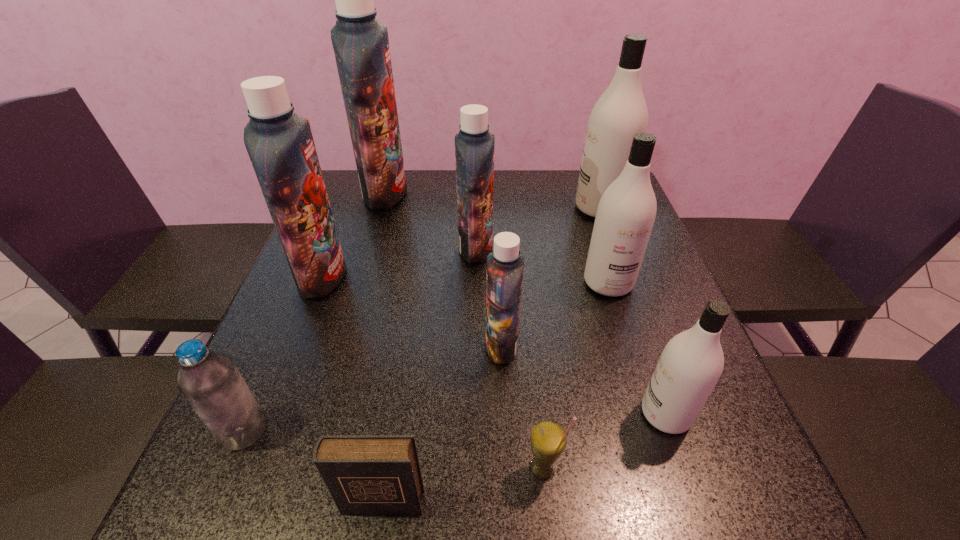
I want to click on the tallest object, so click(361, 45).

The height and width of the screenshot is (540, 960). Find the location of `the biggest blue shampoo`. the biggest blue shampoo is located at coordinates (361, 45).

Identify the location of the biggest white shampoo. The width and height of the screenshot is (960, 540). (621, 111).

I want to click on the second biggest blue shampoo, so click(x=280, y=144).

Where is `the third biggest blue shampoo`? the third biggest blue shampoo is located at coordinates (474, 145).

Where is `the second farthest white shampoo`? the second farthest white shampoo is located at coordinates (626, 212).

The height and width of the screenshot is (540, 960). Find the location of `the sixth farthest object`. the sixth farthest object is located at coordinates (505, 265).

You are a GUI agent. You are given a task and a screenshot of the screen. Output one action in this format:
    pyautogui.click(x=<x>, y=<y>)
    Task: Click on the second nearest shampoo
    This screenshot has width=960, height=540.
    Given the screenshot: What is the action you would take?
    pyautogui.click(x=505, y=265)

The image size is (960, 540). Find the location of `the nearest shampoo`. the nearest shampoo is located at coordinates (691, 363).

Find the location of a particular element. The image size is (960, 540). the smallest white shampoo is located at coordinates coord(691,363).